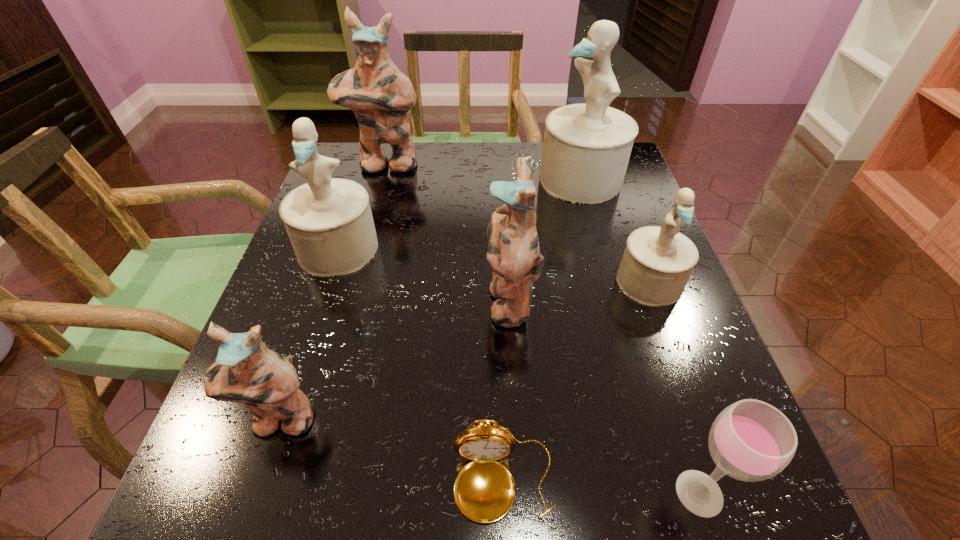
You are a GUI agent. You are given a task and a screenshot of the screen. Output one action in this format:
    pyautogui.click(x=<x>, y=<y>)
    Task: Click on the vacant space located 0.330m at the beak of the biggest white figurine
    This screenshot has height=540, width=960.
    Given the screenshot: What is the action you would take?
    pyautogui.click(x=411, y=179)

This screenshot has height=540, width=960. I want to click on vacant space situated at the beak of the biggest white figurine, so (x=407, y=179).

Find the location of a particular element. This screenshot has width=960, height=540. vacant space located 0.370m at the beak of the biggest white figurine is located at coordinates [x=396, y=179].

Identify the location of vacant space located on the front-facing side of the biggest pink figurine. (372, 210).

Where is `free location located at the beak of the leftmost white figurine`? This screenshot has width=960, height=540. free location located at the beak of the leftmost white figurine is located at coordinates (307, 342).

Where is `vacant space located on the front-facing side of the second farthest pink figurine`? The height and width of the screenshot is (540, 960). vacant space located on the front-facing side of the second farthest pink figurine is located at coordinates click(330, 300).

The width and height of the screenshot is (960, 540). Find the location of `vacant space located 0.190m on the front-facing side of the second farthest pink figurine`. vacant space located 0.190m on the front-facing side of the second farthest pink figurine is located at coordinates (387, 300).

I want to click on vacant region located 0.180m on the front-facing side of the second farthest pink figurine, so pos(392,300).

Where is `vacant space situated at the beak of the smallest white figurine`? Image resolution: width=960 pixels, height=540 pixels. vacant space situated at the beak of the smallest white figurine is located at coordinates (673, 346).

Locate an element on the screen. free space located on the front-facing side of the sixth farthest object is located at coordinates (246, 524).